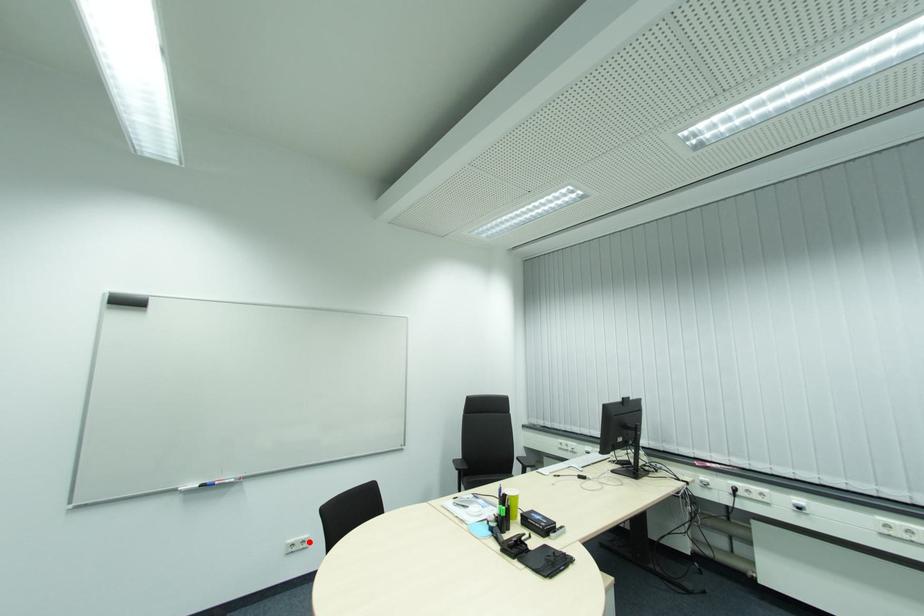
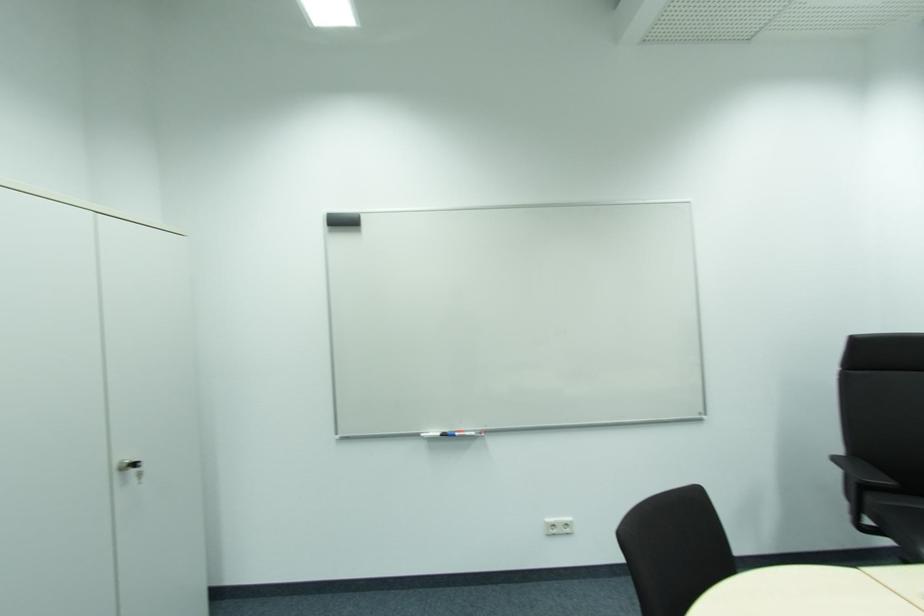
Find the pixel in the second image that matches the highlighted location in the first image.

(572, 524)